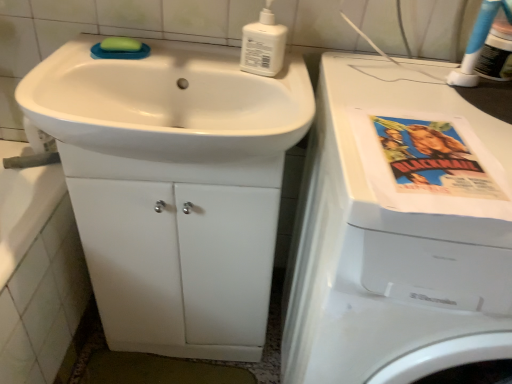
Where is `blank area to the left of green matte soap at upper left`? This screenshot has width=512, height=384. blank area to the left of green matte soap at upper left is located at coordinates (82, 48).